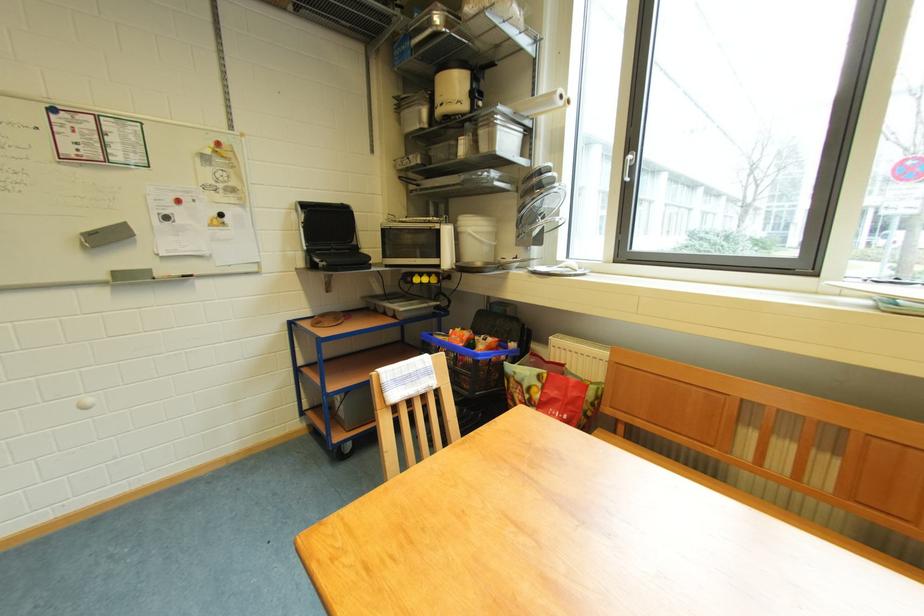
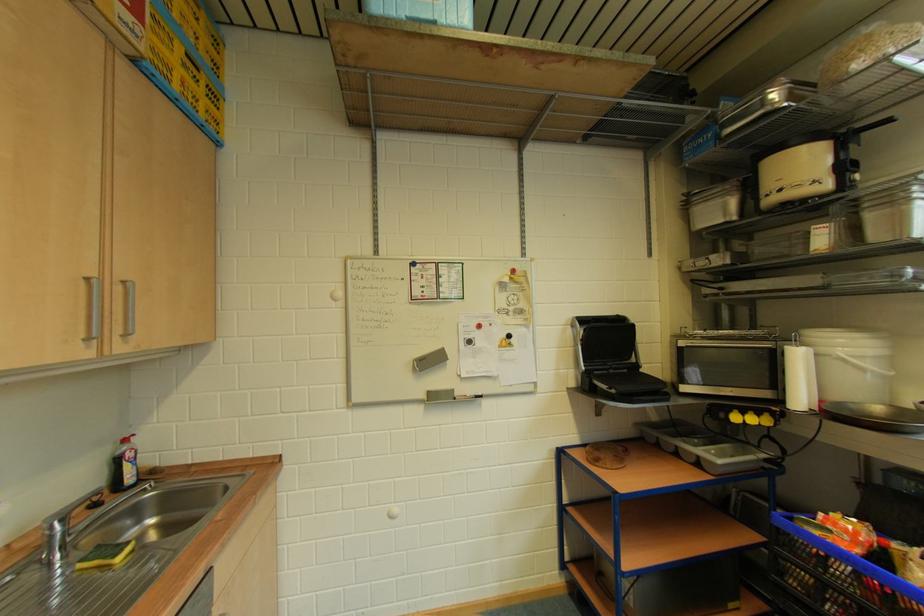
Question: The camera is either moving clockwise (left) or counter-clockwise (right) around the object. The first image is from the beginning of the video and the second image is from the end. Is the camera moving left or right when shooting the video?

Choices:
 (A) Left
 (B) Right

Answer: (B)